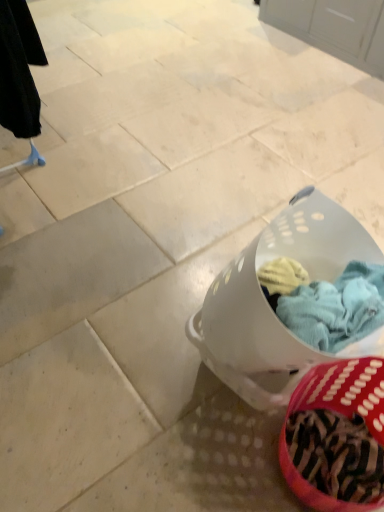
This screenshot has height=512, width=384. Describe the element at coordinates (269, 305) in the screenshot. I see `white plastic laundry basket at lower right` at that location.

In order to face white plastic laundry basket at lower right, should I rotate leftwards or rightwards?

Rotate your view right by about 11.754°.

Locate an element on the screen. The width and height of the screenshot is (384, 512). white plastic laundry basket at lower right is located at coordinates (269, 305).

The width and height of the screenshot is (384, 512). In order to click on zebra-patterned fabric basket at lower right in this screenshot , I will do `click(336, 436)`.

The image size is (384, 512). What do you see at coordinates (336, 436) in the screenshot?
I see `zebra-patterned fabric basket at lower right` at bounding box center [336, 436].

What are the coordinates of `white plastic laundry basket at lower right` in the screenshot? It's located at (269, 305).

Considering the positions of objects zebra-patterned fabric basket at lower right and white plastic laundry basket at lower right in the image provided, who is more to the right, zebra-patterned fabric basket at lower right or white plastic laundry basket at lower right?

From the viewer's perspective, zebra-patterned fabric basket at lower right appears more on the right side.

Considering the relative positions of zebra-patterned fabric basket at lower right and white plastic laundry basket at lower right in the image provided, is zebra-patterned fabric basket at lower right behind white plastic laundry basket at lower right?

No, zebra-patterned fabric basket at lower right is closer to the camera.

Considering the positions of points (346, 507) and (248, 390), is point (346, 507) closer to camera compared to point (248, 390)?

Yes, it is in front of point (248, 390).

From the image's perspective, relative to white plastic laundry basket at lower right, is zebra-patterned fabric basket at lower right above or below?

Based on their image positions, zebra-patterned fabric basket at lower right is located beneath white plastic laundry basket at lower right.

Consider the image. From a real-world perspective, who is located lower, zebra-patterned fabric basket at lower right or white plastic laundry basket at lower right?

From a 3D spatial view, zebra-patterned fabric basket at lower right is below.

Does zebra-patterned fabric basket at lower right have a lesser width compared to white plastic laundry basket at lower right?

Indeed, zebra-patterned fabric basket at lower right has a lesser width compared to white plastic laundry basket at lower right.

Considering the sizes of objects zebra-patterned fabric basket at lower right and white plastic laundry basket at lower right in the image provided, who is taller, zebra-patterned fabric basket at lower right or white plastic laundry basket at lower right?

With more height is white plastic laundry basket at lower right.

Who is bigger, zebra-patterned fabric basket at lower right or white plastic laundry basket at lower right?

white plastic laundry basket at lower right is bigger.

Is zebra-patterned fabric basket at lower right inside or outside of white plastic laundry basket at lower right?

zebra-patterned fabric basket at lower right exists outside the volume of white plastic laundry basket at lower right.

Does zebra-patterned fabric basket at lower right touch white plastic laundry basket at lower right?

No, zebra-patterned fabric basket at lower right is not making contact with white plastic laundry basket at lower right.

Is zebra-patterned fabric basket at lower right facing towards white plastic laundry basket at lower right?

Yes, zebra-patterned fabric basket at lower right is facing white plastic laundry basket at lower right.

Locate an element on the screen. This screenshot has height=512, width=384. basket below the white plastic laundry basket at lower right (from the image's perspective) is located at coordinates (336, 436).

Is white plastic laundry basket at lower right to the left or to the right of zebra-patterned fabric basket at lower right in the image?

white plastic laundry basket at lower right is to the left of zebra-patterned fabric basket at lower right.

Relative to zebra-patterned fabric basket at lower right, is white plastic laundry basket at lower right in front or behind?

In the image, white plastic laundry basket at lower right appears behind zebra-patterned fabric basket at lower right.

Which is behind, point (269, 227) or point (372, 357)?

Positioned behind is point (269, 227).

From the image's perspective, which object appears higher, white plastic laundry basket at lower right or zebra-patterned fabric basket at lower right?

white plastic laundry basket at lower right, from the image's perspective.

From a real-world perspective, relative to zebra-patterned fabric basket at lower right, is white plastic laundry basket at lower right vertically above or below?

white plastic laundry basket at lower right is above zebra-patterned fabric basket at lower right.

Which of these two, white plastic laundry basket at lower right or zebra-patterned fabric basket at lower right, is thinner?

Thinner between the two is zebra-patterned fabric basket at lower right.

Is white plastic laundry basket at lower right taller or shorter than zebra-patterned fabric basket at lower right?

white plastic laundry basket at lower right is taller than zebra-patterned fabric basket at lower right.

Who is smaller, white plastic laundry basket at lower right or zebra-patterned fabric basket at lower right?

Smaller between the two is zebra-patterned fabric basket at lower right.

Do you think white plastic laundry basket at lower right is within zebra-patterned fabric basket at lower right, or outside of it?

white plastic laundry basket at lower right is spatially situated outside zebra-patterned fabric basket at lower right.

Are white plastic laundry basket at lower right and zebra-patterned fabric basket at lower right far apart?

No, white plastic laundry basket at lower right is not far away from zebra-patterned fabric basket at lower right.

Is zebra-patterned fabric basket at lower right at the back of white plastic laundry basket at lower right?

That's right, white plastic laundry basket at lower right is facing away from zebra-patterned fabric basket at lower right.

Can you tell me how much white plastic laundry basket at lower right and zebra-patterned fabric basket at lower right differ in facing direction?

There is a 11.6-degree angle between the facing directions of white plastic laundry basket at lower right and zebra-patterned fabric basket at lower right.

How much distance is there between white plastic laundry basket at lower right and zebra-patterned fabric basket at lower right?

white plastic laundry basket at lower right and zebra-patterned fabric basket at lower right are 7.68 inches apart from each other.

You are a GUI agent. You are given a task and a screenshot of the screen. Output one action in this format:
    pyautogui.click(x=<x>, y=<y>)
    Task: Click on the laundry basket above the zebra-patterned fabric basket at lower right (from a real-world perspective)
    
    Given the screenshot: What is the action you would take?
    [x=269, y=305]

The image size is (384, 512). In order to click on basket that appears on the right of white plastic laundry basket at lower right in this screenshot , I will do `click(336, 436)`.

Find the location of a particular element. Image resolution: width=384 pixels, height=512 pixels. laundry basket that appears behind the zebra-patterned fabric basket at lower right is located at coordinates (269, 305).